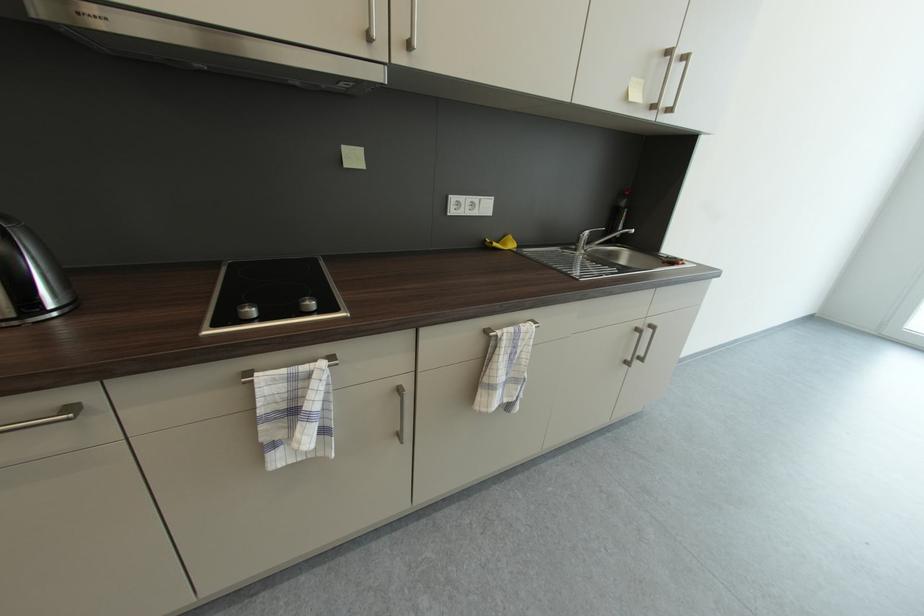
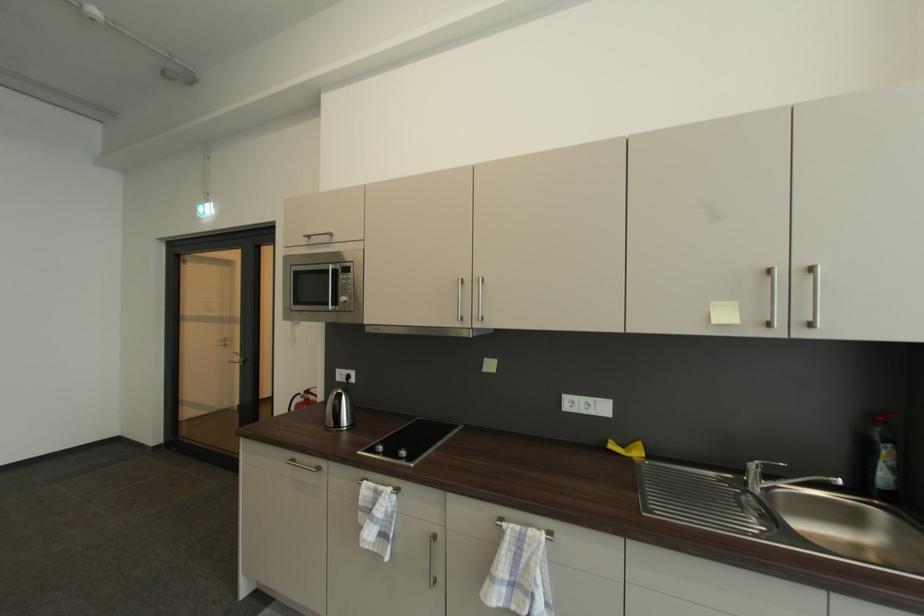
The point at (492, 243) is marked in the first image. Where is the corresponding point in the second image?

(613, 443)